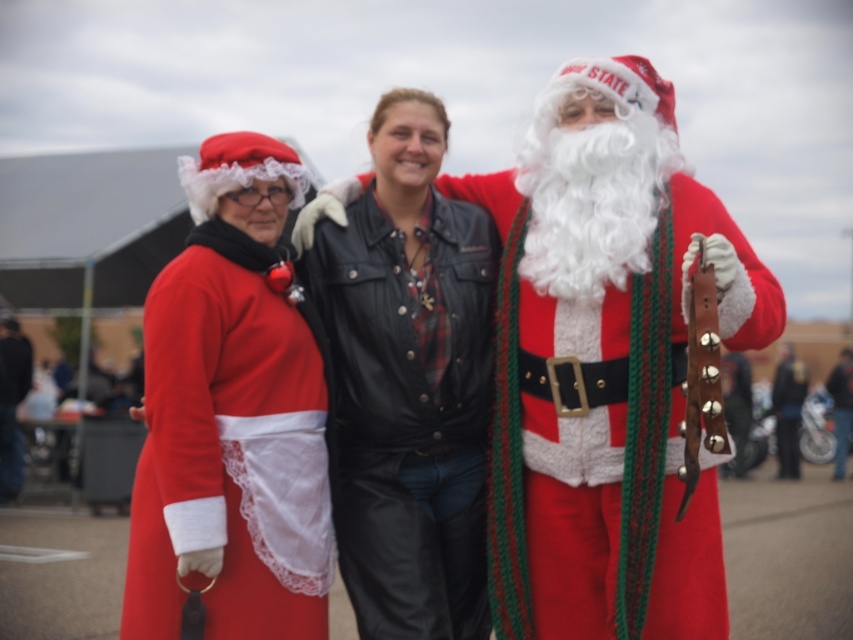
You are standing at the point with coordinates point (398, 458) and want to move towards the point with coordinates point (576, 440). According to the scene, will you be moving forward or backward?

Point (576, 440) is in front of point (398, 458), so moving towards it would mean moving forward.

In the scene shown: You are a costume designer observing the festive scene. You need to adjust the leather jacket at center and the shiny metallic belt at center so that the belt is positioned higher than the jacket. Is this possible without removing either item?

The leather jacket at center is currently above the shiny metallic belt at center. To position the belt higher than the jacket, you would need to move the belt upwards so it is above the jacket, which would require adjusting their positions since they are both on the same person.